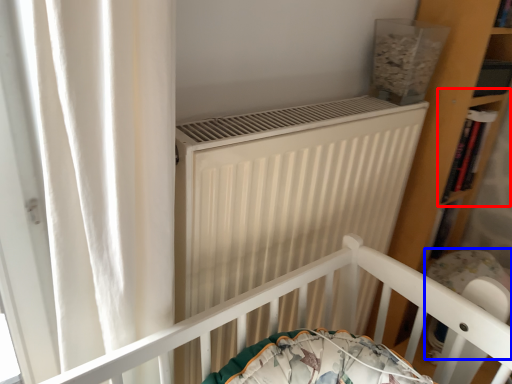
Question: Which point is further to the camera, shelf (highlighted by a red box) or baby carriage (highlighted by a blue box)?

Choices:
 (A) shelf
 (B) baby carriage

Answer: (A)